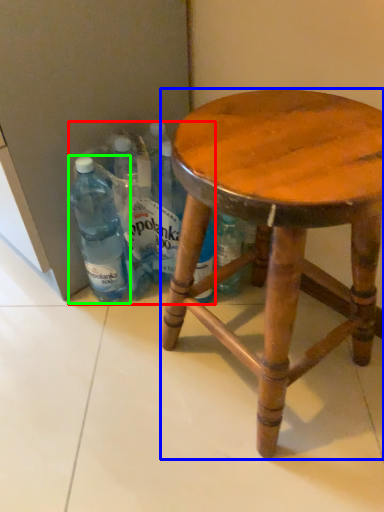
Question: Which object is the farthest from beverage (highlighted by a red box)? Choose among these: stool (highlighted by a blue box) or bottle (highlighted by a green box).

Choices:
 (A) stool
 (B) bottle

Answer: (A)